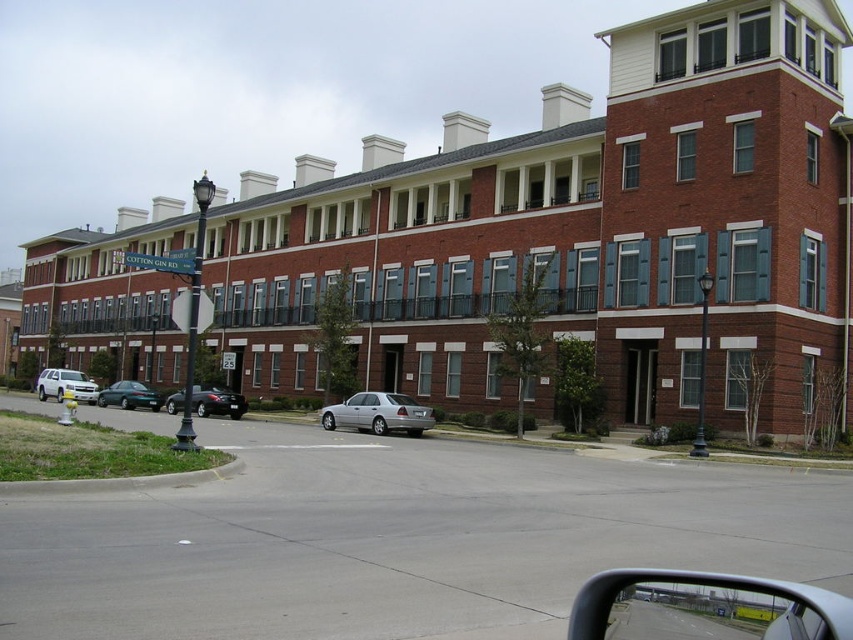
Question: Among these points, which one is farthest from the camera?

Choices:
 (A) (137, 397)
 (B) (74, 385)

Answer: (B)

Question: From the image, what is the correct spatial relationship of silver metallic suv at lower left in relation to green matte sedan at center-left?

Choices:
 (A) above
 (B) below

Answer: (B)

Question: Among these points, which one is nearest to the camera?

Choices:
 (A) (136, 387)
 (B) (326, 412)
 (C) (242, 410)

Answer: (B)

Question: Where is silver metallic suv at lower left located in relation to green matte sedan at center-left in the image?

Choices:
 (A) left
 (B) right

Answer: (A)

Question: Is silver metallic sedan at center below green matte sedan at center-left?

Choices:
 (A) yes
 (B) no

Answer: (B)

Question: Which object is closer to the camera taking this photo?

Choices:
 (A) silver metallic sedan at center
 (B) green matte sedan at center-left
 (C) silver metallic suv at lower left

Answer: (A)